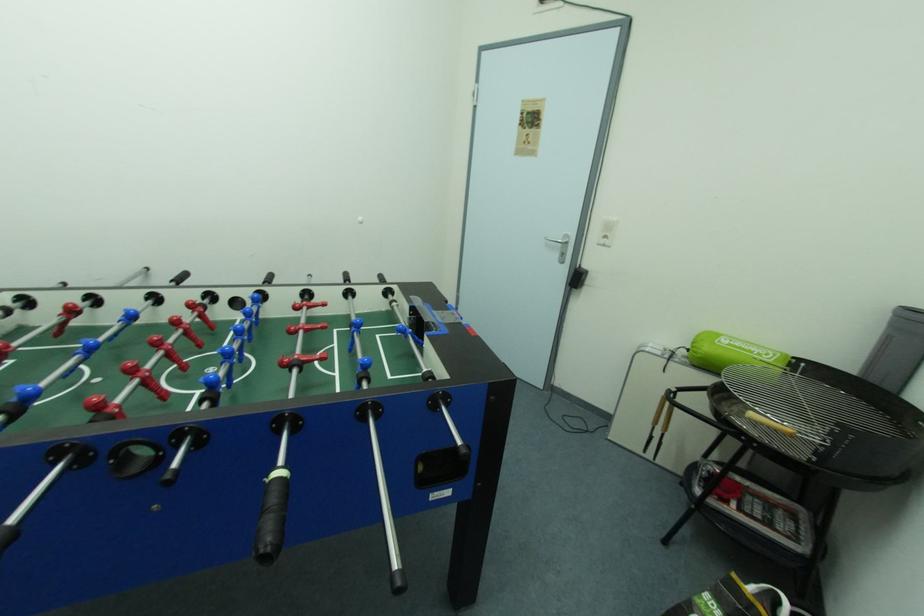
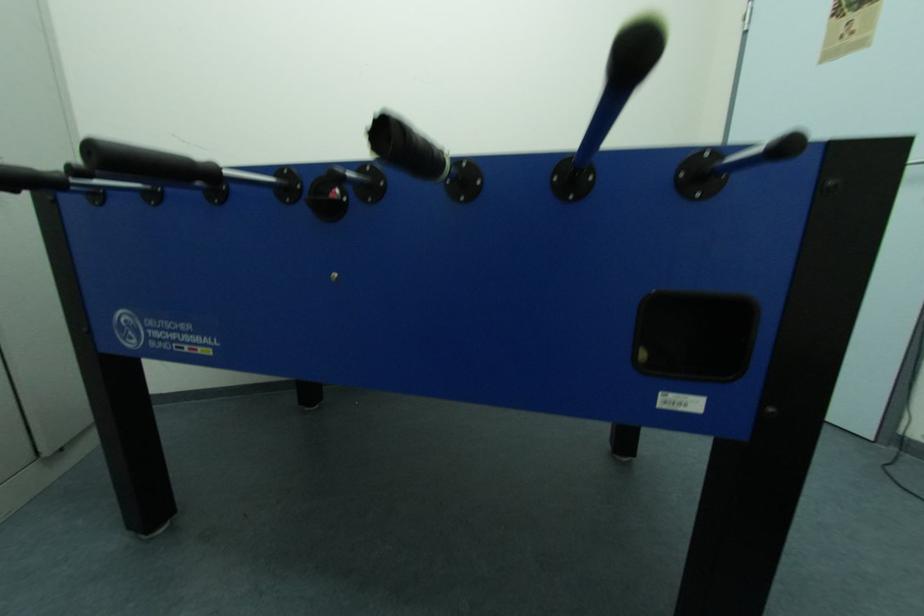
Question: How did the camera likely rotate?

Choices:
 (A) Left
 (B) Right
 (C) Up
 (D) Down

Answer: (A)